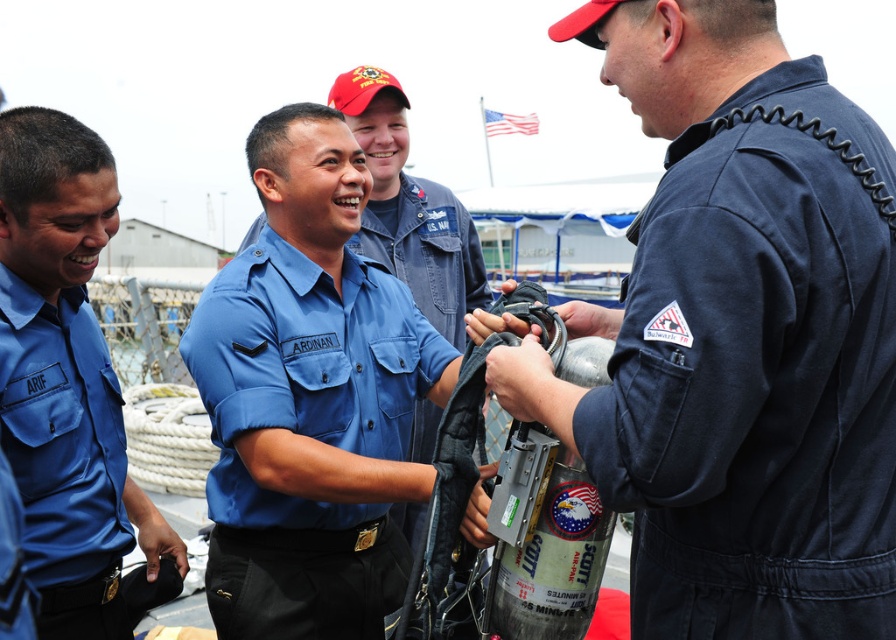
Question: Is navy blue fabric jumpsuit at right above matte blue shirt at center?

Choices:
 (A) no
 (B) yes

Answer: (B)

Question: Which of the following is the farthest from the observer?

Choices:
 (A) navy blue fabric jumpsuit at right
 (B) blue uniform shirt at center

Answer: (B)

Question: Which object is the farthest from the matte blue shirt at center?

Choices:
 (A) blue uniform shirt at center
 (B) navy blue fabric jumpsuit at right

Answer: (B)

Question: Is matte blue shirt at center below blue uniform shirt at center?

Choices:
 (A) yes
 (B) no

Answer: (A)

Question: Among these objects, which one is farthest from the camera?

Choices:
 (A) matte blue shirt at center
 (B) navy blue fabric jumpsuit at right

Answer: (A)

Question: Where is navy blue fabric jumpsuit at right located in relation to matte blue shirt at center in the image?

Choices:
 (A) right
 (B) left

Answer: (A)